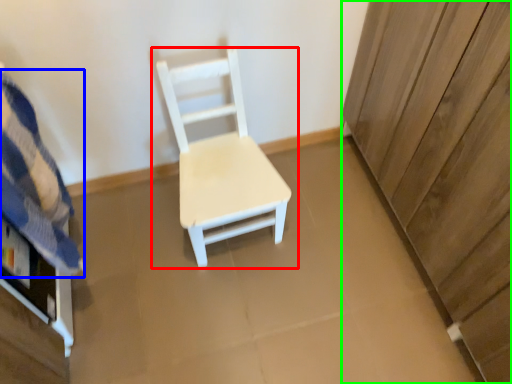
Question: Estimate the real-world distances between objects in this image. Which object is closer to chair (highlighted by a red box), bedding (highlighted by a blue box) or dresser (highlighted by a green box)?

Choices:
 (A) bedding
 (B) dresser

Answer: (A)